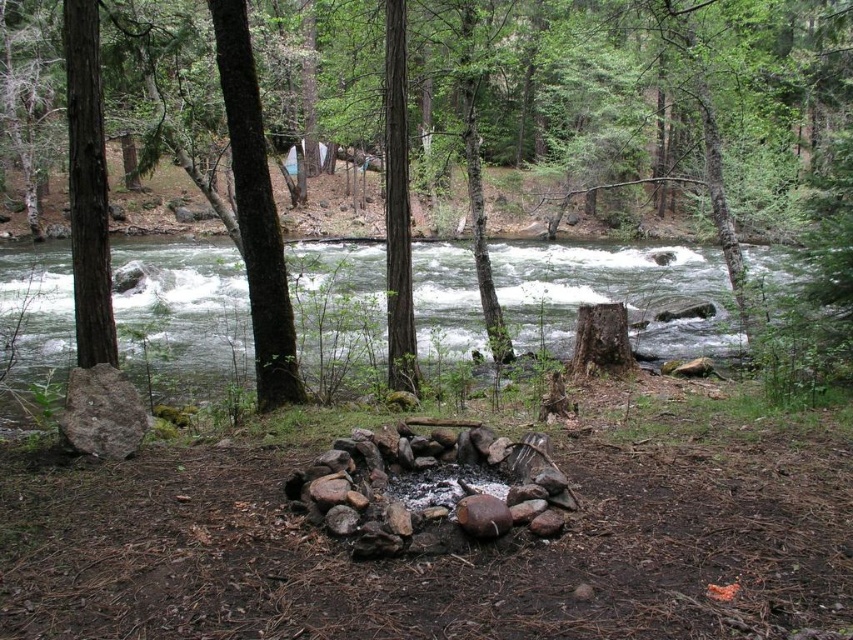
Question: Does brown rough tree trunk at center appear on the right side of brown rough bark tree at left?

Choices:
 (A) yes
 (B) no

Answer: (A)

Question: Among these objects, which one is nearest to the camera?

Choices:
 (A) brown rough bark tree at left
 (B) brown rough tree trunk at center
 (C) brown rough bark tree at center

Answer: (A)

Question: Does brown rough tree trunk at center have a lesser width compared to brown rough bark tree at center?

Choices:
 (A) yes
 (B) no

Answer: (B)

Question: Based on their relative distances, which object is farther from the brown rough bark tree at center?

Choices:
 (A) brown rough bark tree at left
 (B) brown rough tree trunk at center
 (C) green mossy river at center

Answer: (B)

Question: Does brown rough bark tree at center appear on the right side of brown rough bark tree at left?

Choices:
 (A) no
 (B) yes

Answer: (B)

Question: Which object appears farthest from the camera in this image?

Choices:
 (A) brown rough tree trunk at center
 (B) brown rough bark tree at left
 (C) brown rough bark tree at center

Answer: (C)